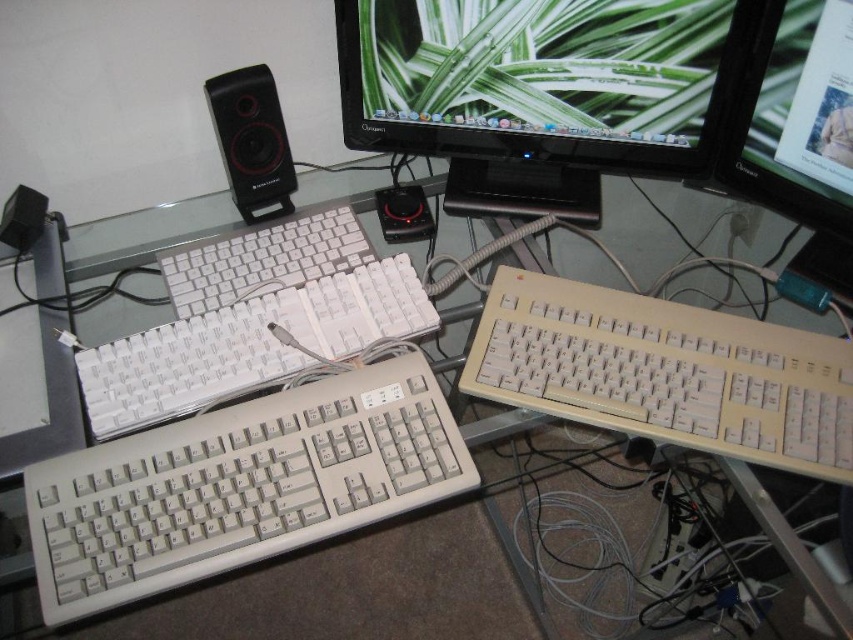
You are setting up a new mouse pad for your desk. You want to place it between the beige plastic keyboard at lower right and the white plastic keyboard at center so that it is equidistant from both. Is this possible given their current spacing?

The beige plastic keyboard at lower right is 9.90 inches from the white plastic keyboard at center. Since the distance between them is a fixed 9.90 inches, placing the mouse pad exactly halfway would make it 4.95 inches from each, which is possible.

You are setting up a desk and need to place a new cable that connects to both the matte plastic monitor at upper center and the black plastic speaker at upper left. Based on their positions, where should you route the cable to avoid blocking the speaker?

The matte plastic monitor at upper center is positioned over the black plastic speaker at upper left, so routing the cable along the back or side of the monitor would avoid blocking the speaker.

You are looking at the desk setup with two points marked. Which point, point (x=368, y=26) or point (x=244, y=120), is closer to you?

Point (x=368, y=26) is closer to the viewer than point (x=244, y=120).